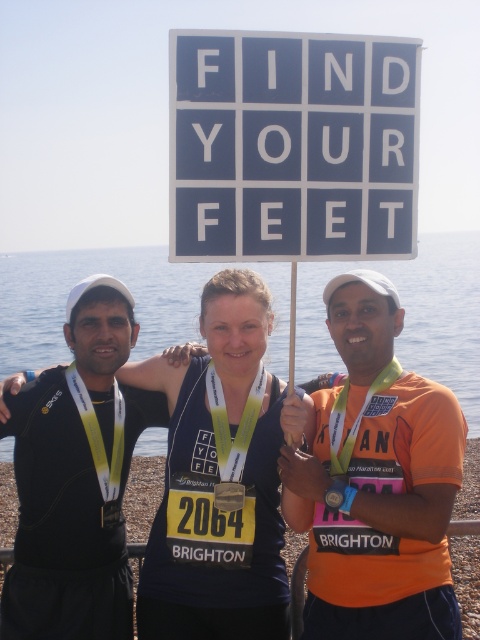
Question: Which of these objects is positioned farthest from the shiny blue tank top at center?

Choices:
 (A) white plastic sign at upper center
 (B) orange fabric shirt at center

Answer: (A)

Question: Among these objects, which one is farthest from the camera?

Choices:
 (A) shiny blue tank top at center
 (B) white plastic sign at upper center
 (C) orange fabric shirt at center

Answer: (A)

Question: Observing the image, what is the correct spatial positioning of white plastic sign at upper center in reference to orange fabric shirt at center?

Choices:
 (A) left
 (B) right

Answer: (A)

Question: Is orange fabric shirt at center wider than shiny blue tank top at center?

Choices:
 (A) yes
 (B) no

Answer: (B)

Question: Which object is closer to the camera taking this photo?

Choices:
 (A) orange fabric shirt at center
 (B) white plastic sign at upper center

Answer: (B)

Question: Is orange fabric shirt at center positioned in front of shiny blue tank top at center?

Choices:
 (A) yes
 (B) no

Answer: (A)